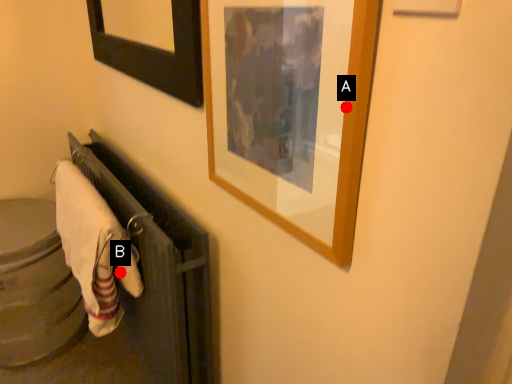
Question: Two points are circled on the image, labeled by A and B beside each circle. Which point appears closest to the camera in this image?

Choices:
 (A) A is closer
 (B) B is closer

Answer: (A)